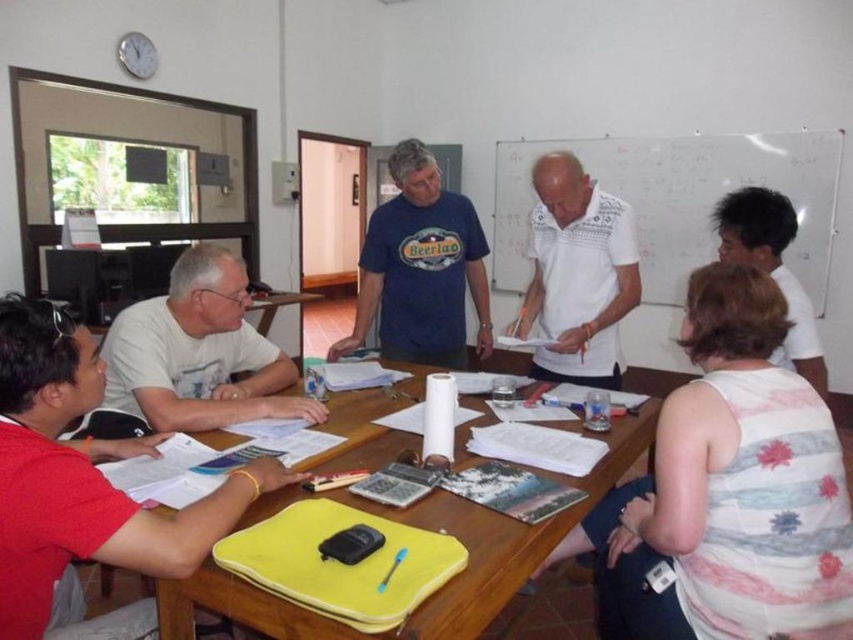
What is the exact coordinate of the white floral tank top at center?

The white floral tank top at center is located at point (x=729, y=490).